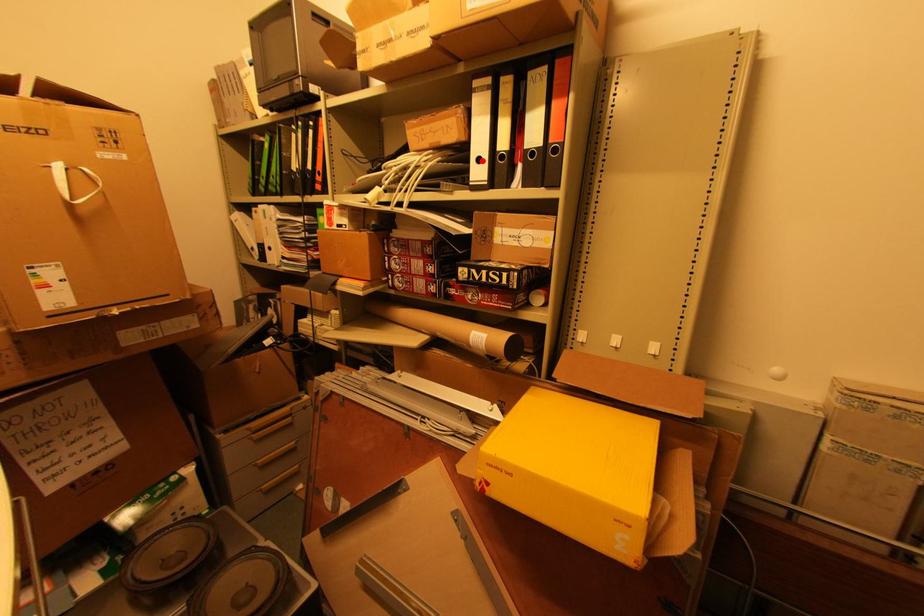
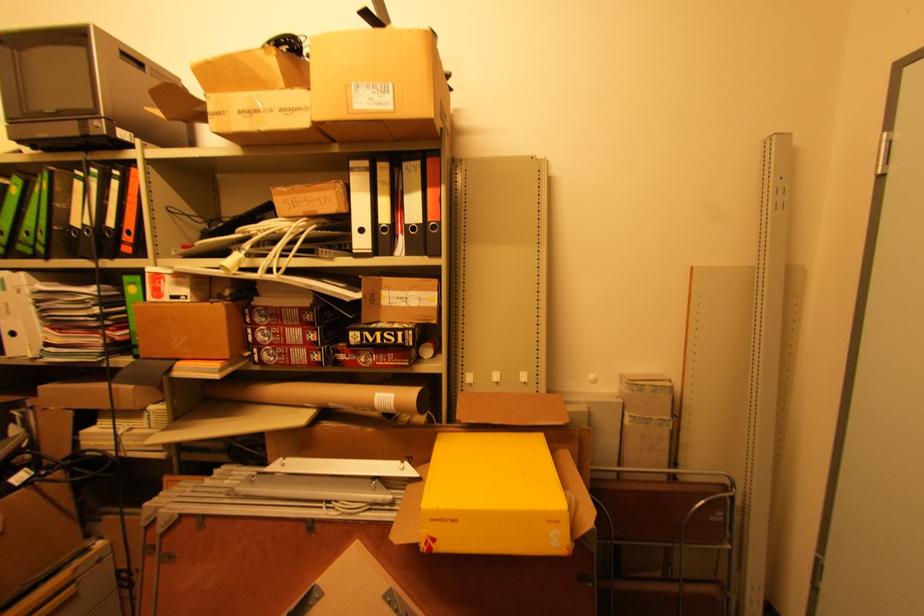
In the second image, find the point that corresponds to the highlighted location in the first image.

(365, 231)